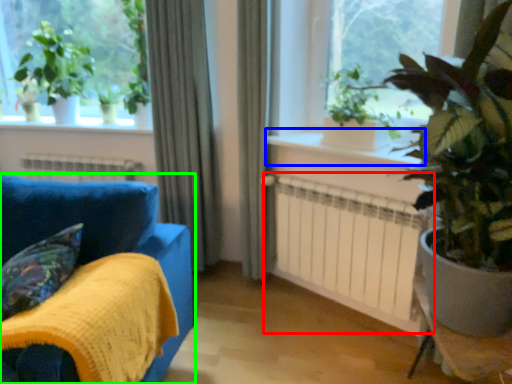
Question: Which object is positioned closest to radiator (highlighted by a red box)? Select from window sill (highlighted by a blue box) and furniture (highlighted by a green box).

Choices:
 (A) window sill
 (B) furniture

Answer: (A)